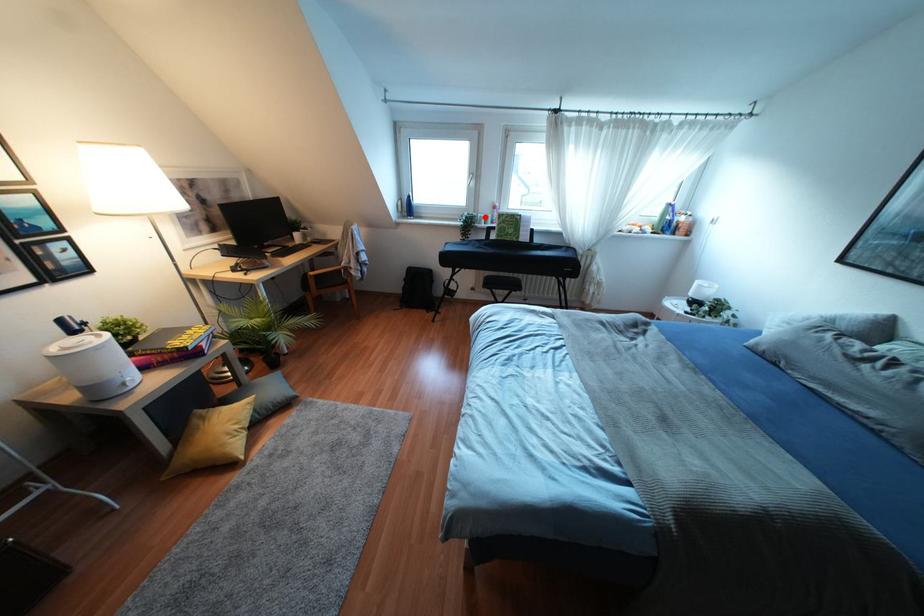
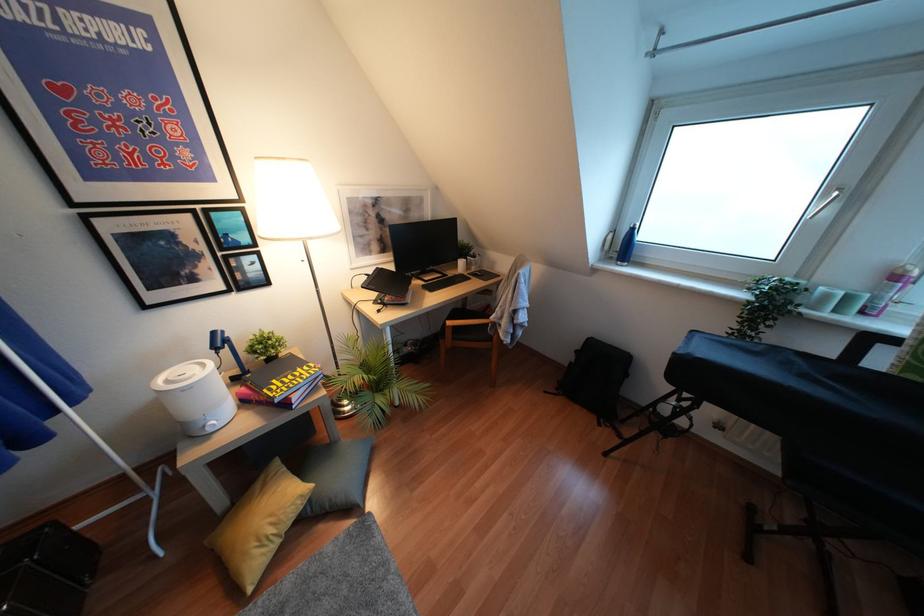
Question: I am providing you with two images of the same scene from different viewpoints. In image1, a red point is highlighted. Considering the same 3D point in image2, which of the following is correct?

Choices:
 (A) It is closer
 (B) It is farther

Answer: (B)